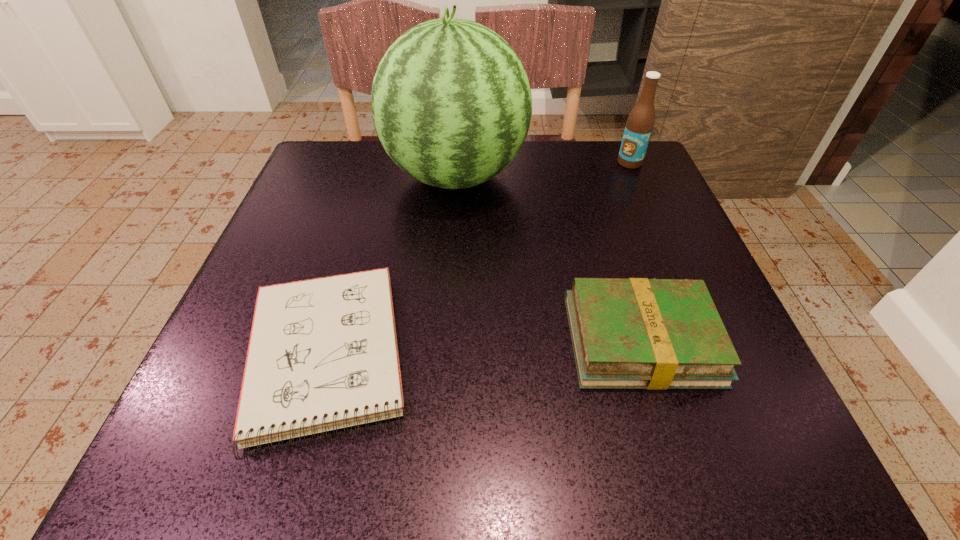
Locate an element on the screen. The image size is (960, 540). empty space that is in between the second tallest object and the notepad is located at coordinates (477, 258).

Where is `empty space between the tallest object and the third shortest object`? empty space between the tallest object and the third shortest object is located at coordinates (542, 170).

At what (x,y) coordinates should I click in order to perform the action: click on object that is the third closest to the shortest object. Please return your answer as a coordinate pair (x, y). The width and height of the screenshot is (960, 540). Looking at the image, I should click on (640, 122).

Locate an element on the screen. This screenshot has width=960, height=540. the second closest object to the notepad is located at coordinates (637, 333).

Locate an element on the screen. The height and width of the screenshot is (540, 960). blank space that satisfies the following two spatial constraints: 1. on the back side of the notepad; 2. on the left side of the beer bottle is located at coordinates (381, 163).

Locate an element on the screen. This screenshot has height=540, width=960. vacant region that satisfies the following two spatial constraints: 1. on the back side of the third tallest object; 2. on the right side of the beer bottle is located at coordinates (586, 163).

I want to click on free space that satisfies the following two spatial constraints: 1. on the front side of the tallest object; 2. on the left side of the book, so click(x=444, y=340).